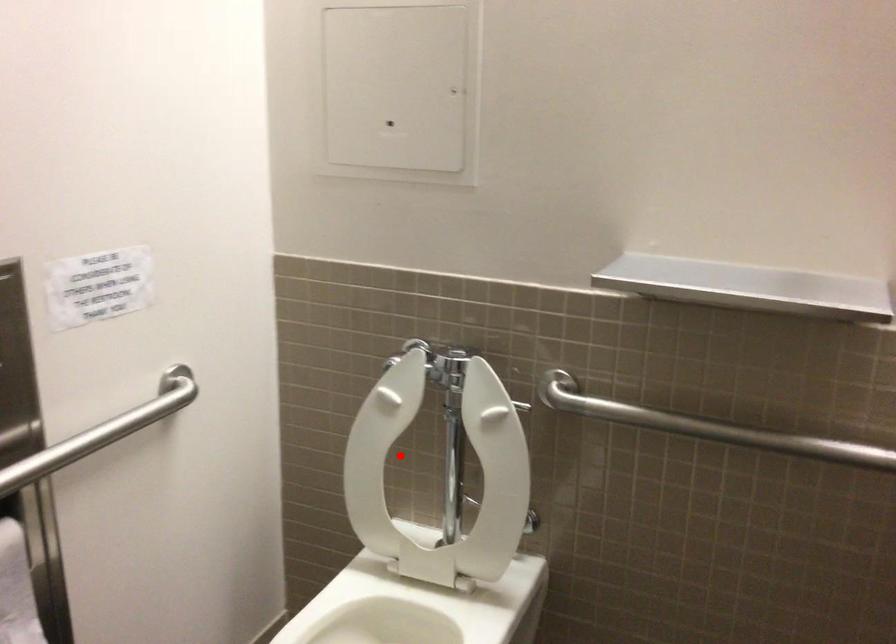
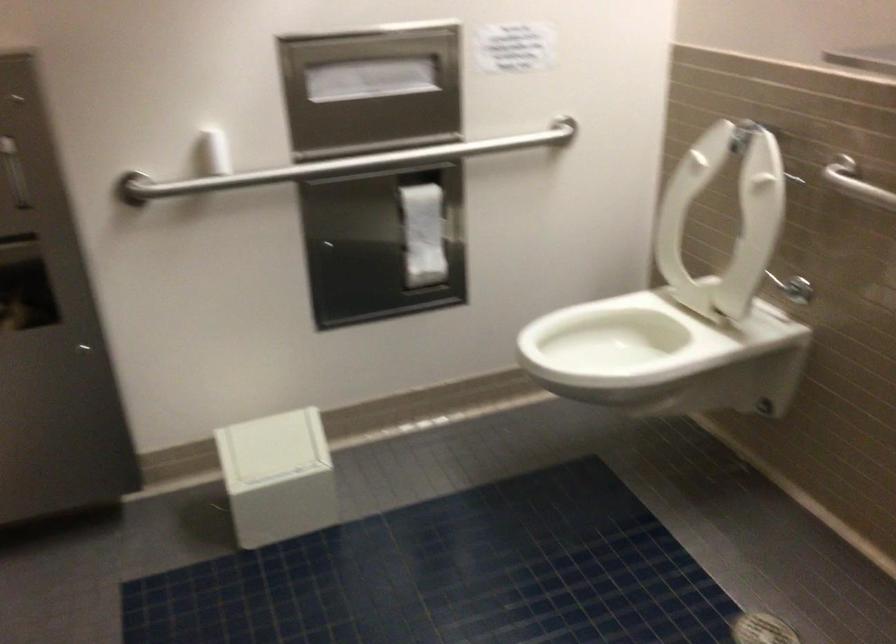
Find the pixel in the second image that matches the highlighted location in the first image.

(724, 219)